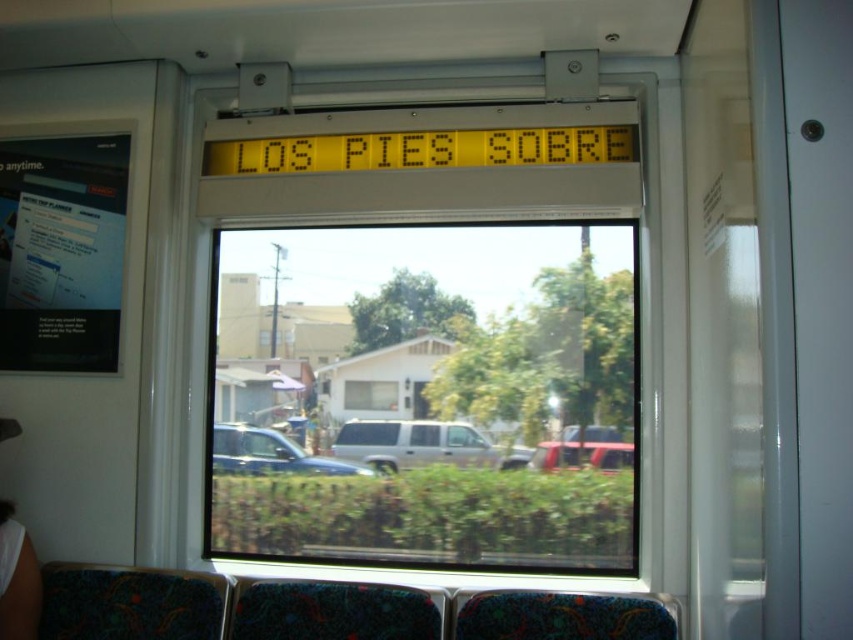
Can you confirm if silver metallic suv at center is wider than metallic silver car at center?

Correct, the width of silver metallic suv at center exceeds that of metallic silver car at center.

Is point (389, 465) less distant than point (346, 465)?

Yes, point (389, 465) is closer to viewer.

Locate an element on the screen. This screenshot has height=640, width=853. silver metallic suv at center is located at coordinates (422, 444).

Who is positioned more to the left, clear glass window at center or metallic red car at center?

From the viewer's perspective, clear glass window at center appears more on the left side.

Who is positioned more to the right, clear glass window at center or metallic red car at center?

Positioned to the right is metallic red car at center.

Does point (315, 492) lie behind point (537, 465)?

Yes, point (315, 492) is farther from viewer.

Locate an element on the screen. This screenshot has height=640, width=853. clear glass window at center is located at coordinates (430, 396).

Between clear glass window at center and silver metallic suv at center, which one is positioned lower?

Positioned lower is silver metallic suv at center.

Which is behind, point (390, 380) or point (416, 449)?

Point (390, 380)

Between point (341, 301) and point (341, 438), which one is positioned behind?

Point (341, 301)

Find the location of a particular element. clear glass window at center is located at coordinates (430, 396).